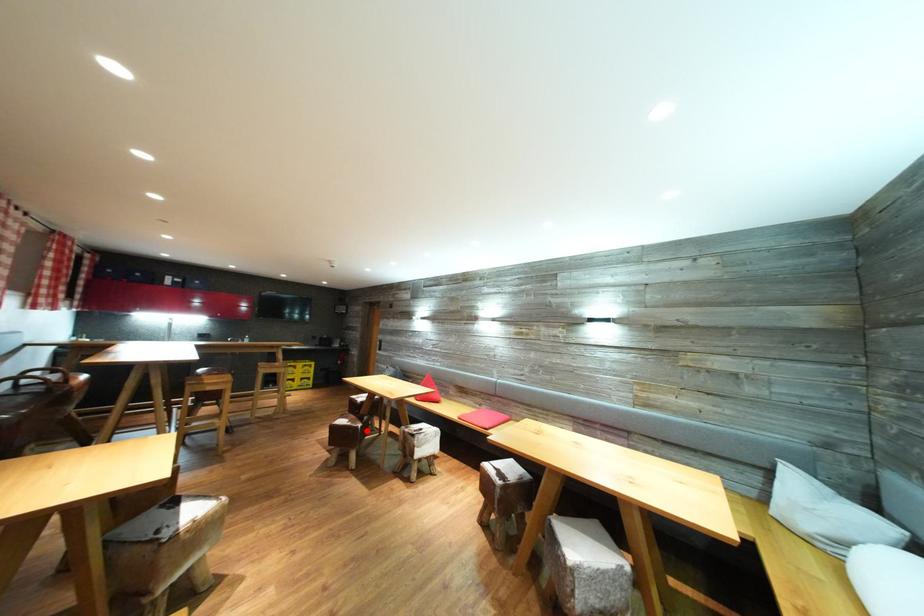
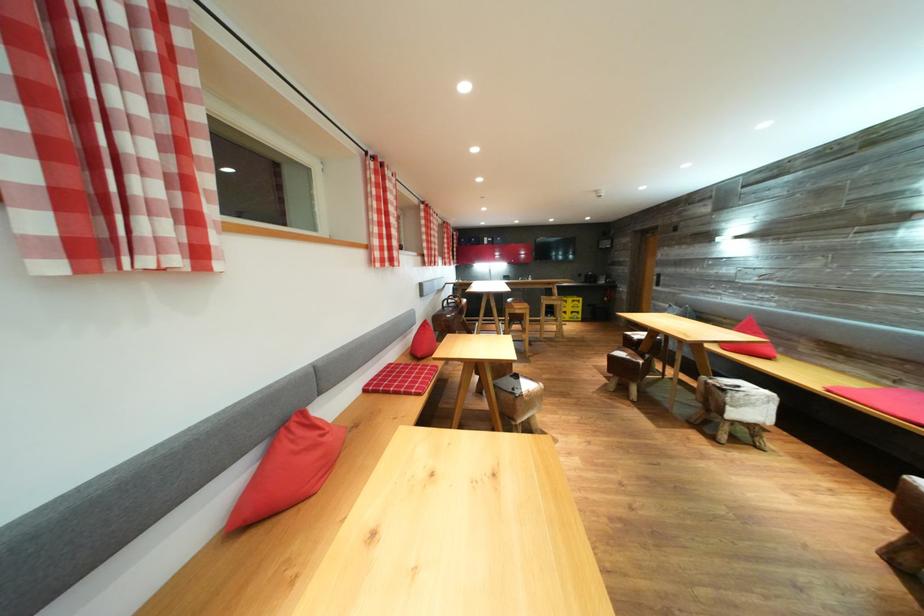
Question: I am providing you with two images of the same scene from different viewpoints. Image1 has a red point marked. In image2, the corresponding 3D location appears at what relative position? Reply with the corresponding letter.

Choices:
 (A) Closer
 (B) Farther

Answer: (A)